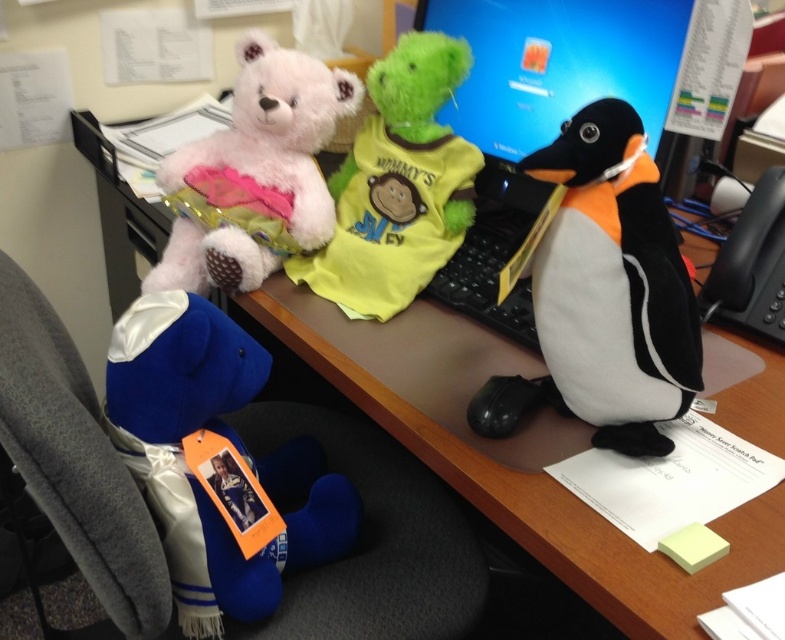
You are organizing the desk and want to place a new item between the blue satin teddy bear at lower left and the fluffy pink bear at center. Based on their positions, where should you place the item to ensure it is between them?

The blue satin teddy bear at lower left is below the fluffy pink bear at center, so placing the item above the blue satin teddy bear at lower left and below the fluffy pink bear at center would position it between them.

You are organizing a desk and need to place a new item between the black plush penguin at right and the fluffy white teddy bear at upper left. The item is 10 inches wide. Can it fit between them?

The distance between the black plush penguin at right and the fluffy white teddy bear at upper left is 21.04 inches. Since the item is 10 inches wide, there is enough space to place it between them.

You are trying to determine which of the two points, point (330,497) or point (305,68), is closer to you in the image. Based on the scene description, which point is closer?

Point (330,497) is closer to the camera than point (305,68).